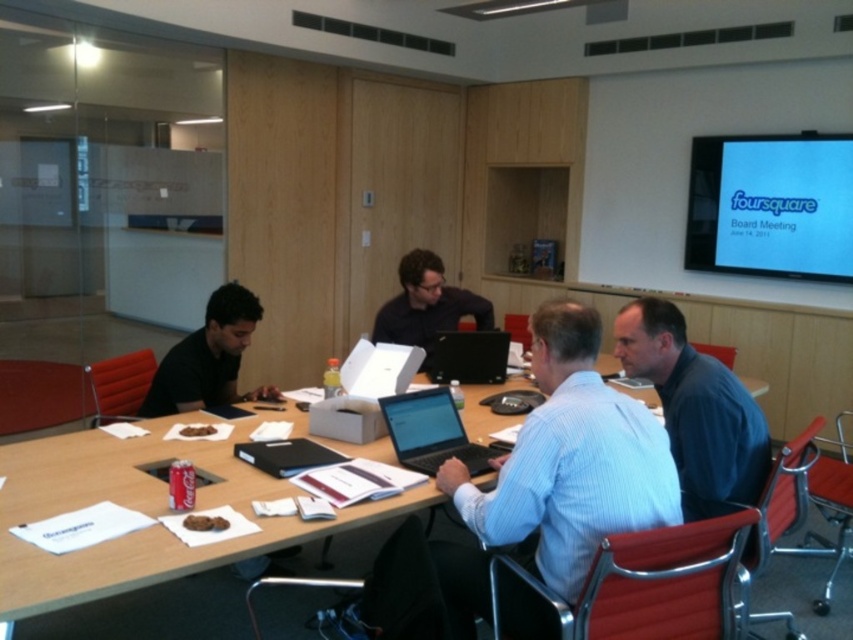
Is point (434, 456) closer to camera compared to point (479, 349)?

Yes, point (434, 456) is in front of point (479, 349).

Who is lower down, silver metallic laptop at center or black matte laptop at center?

silver metallic laptop at center

Identify the location of silver metallic laptop at center. (431, 433).

Who is more distant from viewer, (49, 595) or (485, 321)?

The point (485, 321) is more distant.

Does wooden table at center lie behind matte black laptop at center?

That is False.

Is point (3, 604) farther from viewer compared to point (432, 317)?

No.

Where is `wooden table at center`? wooden table at center is located at coordinates (143, 512).

Is wooden table at center wider than black matte laptop at center?

Indeed, wooden table at center has a greater width compared to black matte laptop at center.

Between wooden table at center and black matte laptop at center, which one appears on the left side from the viewer's perspective?

wooden table at center

Is point (47, 486) positioned after point (469, 364)?

No.

Where is `wooden table at center`? Image resolution: width=853 pixels, height=640 pixels. wooden table at center is located at coordinates (143, 512).